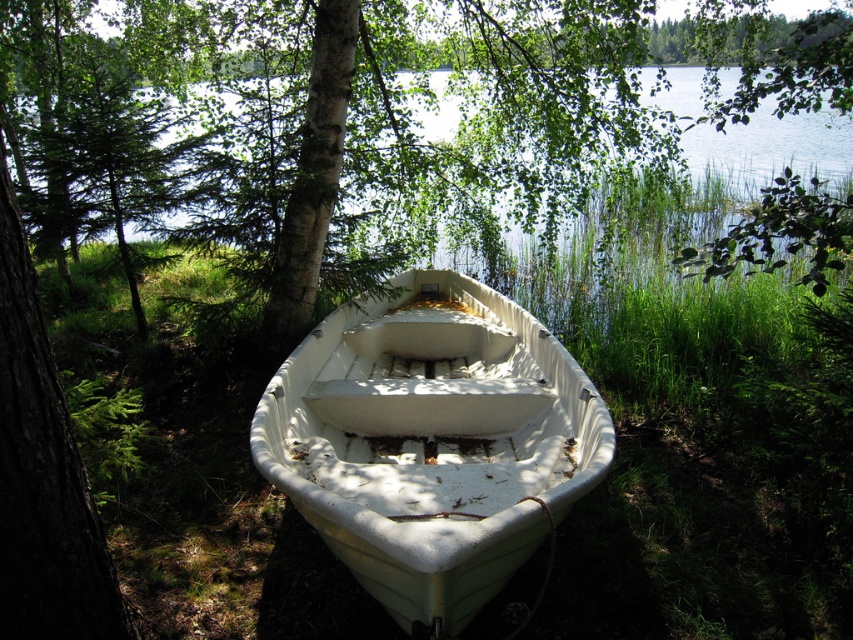
You are standing at the edge of the lake and see two points marked on the image. Which point is closer to you, point (474,600) or point (846,147)?

Point (474,600) is in front of point (846,147), so it is closer to you.

You are a photographer planning to capture the white matte boat at center and the transparent water at center in a single shot. Considering their heights, which object should you position closer to the camera to ensure both are fully visible in the frame?

The white matte boat at center has a lesser height compared to transparent water at center, so you should position the white matte boat at center closer to the camera to ensure both are fully visible in the frame.